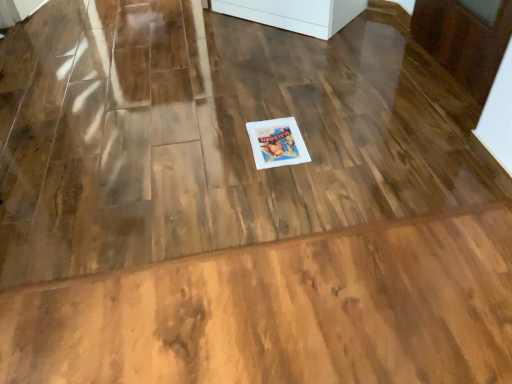
Image resolution: width=512 pixels, height=384 pixels. What are the coordinates of `unoccupied region to the right of white glossy comic book at center` in the screenshot? It's located at (331, 137).